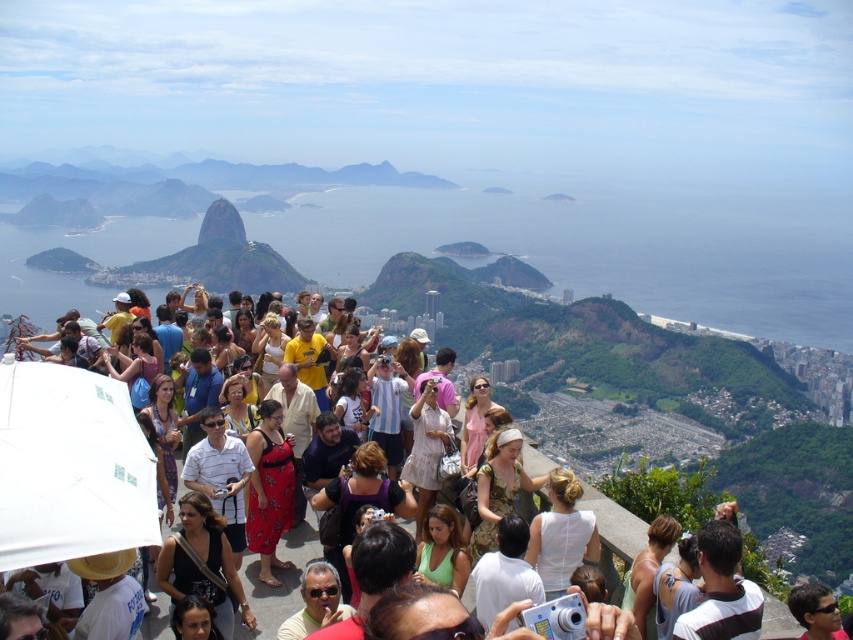
You are a photographer trying to capture a photo of both the white lace dress at center and the matte yellow shirt at center. Which one should you adjust your camera angle to focus on first if you want to include both subjects in the frame?

You should focus on the matte yellow shirt at center first because the white lace dress at center is to the right of it, so adjusting the angle to include both would require starting from the leftmost subject.

You are standing on the hill and want to reach the point marked at coordinates point [425,403]. If your walking speed is 3 feet per second, how long will it take you to reach that point?

The point marked at coordinates point [425,403] is 1962.30 feet away from the viewer. At a walking speed of 3 feet per second, it would take approximately 654.1 seconds, which is roughly 10.9 minutes, to reach that point.